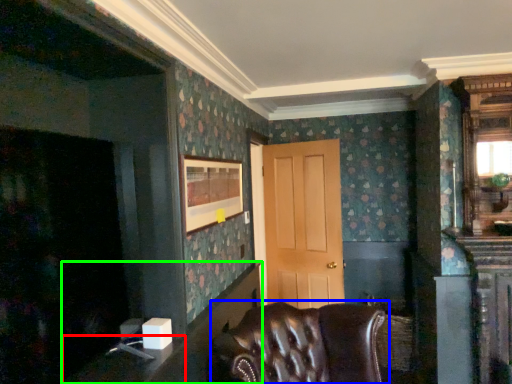
Question: Which object is the closest to the table (highlighted by a red box)? Choose among these: chair (highlighted by a blue box) or table (highlighted by a green box).

Choices:
 (A) chair
 (B) table

Answer: (B)